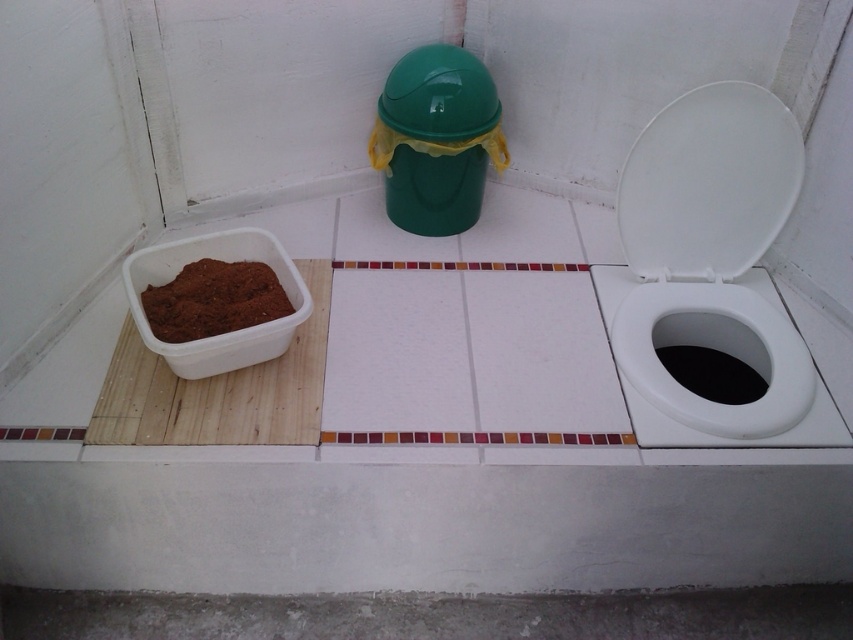
You are standing in the bathroom and need to place a small decorative item on the toilet. The item is too heavy to put on the toilet lid but can go on the toilet bowl. Which object from the scene should you choose between the white glossy toilet lid at upper right and the white glossy toilet bowl at lower right?

The white glossy toilet bowl at lower right can hold the item since it is sturdier and the toilet lid at upper right is above it, making the bowl a better choice for placing heavy objects.

You are a housekeeper entering the bathroom and need to place a new trash bag into the green matte trash can lid at upper center. To do this, you must first locate the trash can. Based on the scene, where should you look relative to the white glossy toilet bowl at lower right?

The white glossy toilet bowl at lower right is positioned on the right side of the green matte trash can lid at upper center, so the green matte trash can lid at upper center is located to the left of the white glossy toilet bowl at lower right. Therefore, you should look to the left of the white glossy toilet bowl at lower right to find the trash can.

Looking at this image, you are standing in the bathroom and need to determine which lid is taller. You see the white glossy toilet lid at upper right and the green matte trash can lid at upper center. Which one is taller?

The white glossy toilet lid at upper right is taller than the green matte trash can lid at upper center according to the description.